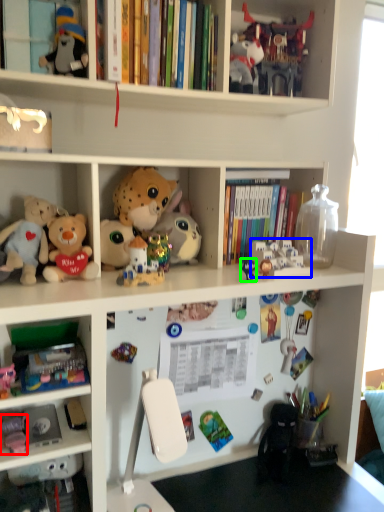
Question: Based on their relative distances, which object is farther from toy (highlighted by a red box)? Choose from toy (highlighted by a blue box) and toy (highlighted by a green box).

Choices:
 (A) toy
 (B) toy

Answer: (A)